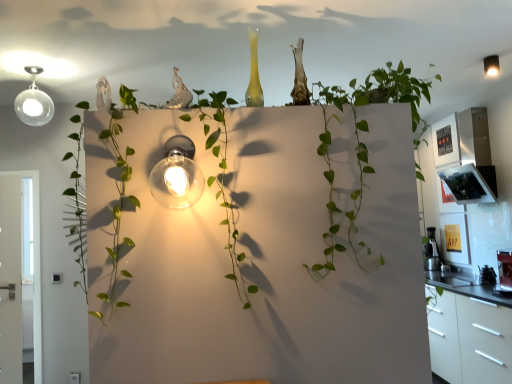
Question: Is matte black light fixture at upper right, which is counted as the second light fixture, starting from the left, thinner than metallic silver coffee maker at right?

Choices:
 (A) no
 (B) yes

Answer: (B)

Question: From a real-world perspective, is matte black light fixture at upper right, which is the 2th light fixture in front-to-back order, beneath metallic silver coffee maker at right?

Choices:
 (A) no
 (B) yes

Answer: (A)

Question: Can you confirm if matte black light fixture at upper right, which is counted as the second light fixture, starting from the left, is wider than metallic silver coffee maker at right?

Choices:
 (A) no
 (B) yes

Answer: (A)

Question: Is matte black light fixture at upper right, which is the 2th light fixture in front-to-back order, to the right of metallic silver coffee maker at right from the viewer's perspective?

Choices:
 (A) no
 (B) yes

Answer: (A)

Question: Considering the relative sizes of matte black light fixture at upper right, which is the 2th light fixture in front-to-back order, and metallic silver coffee maker at right in the image provided, is matte black light fixture at upper right, which is the 2th light fixture in front-to-back order, bigger than metallic silver coffee maker at right?

Choices:
 (A) no
 (B) yes

Answer: (A)

Question: Looking at their shapes, would you say white glossy cabinet at right is wider or thinner than clear glass light fixture at center, placed as the second light fixture when sorted from right to left?

Choices:
 (A) wide
 (B) thin

Answer: (A)

Question: From their relative heights in the image, would you say white glossy cabinet at right is taller or shorter than clear glass light fixture at center, the 1th light fixture from the bottom?

Choices:
 (A) tall
 (B) short

Answer: (A)

Question: Which is correct: white glossy cabinet at right is inside clear glass light fixture at center, which is the first light fixture in front-to-back order, or outside of it?

Choices:
 (A) outside
 (B) inside

Answer: (A)

Question: Is point (483, 319) positioned closer to the camera than point (186, 157)?

Choices:
 (A) farther
 (B) closer

Answer: (A)

Question: Is point (497, 59) positioned closer to the camera than point (449, 362)?

Choices:
 (A) closer
 (B) farther

Answer: (A)

Question: Visually, is matte black light fixture at upper right, marked as the 1th light fixture in a right-to-left arrangement, positioned to the left or to the right of white glossy cabinet at right?

Choices:
 (A) right
 (B) left

Answer: (B)

Question: From the image's perspective, is matte black light fixture at upper right, which is the 2th light fixture in front-to-back order, above or below white glossy cabinet at right?

Choices:
 (A) above
 (B) below

Answer: (A)

Question: From a real-world perspective, is matte black light fixture at upper right, placed as the first light fixture when sorted from top to bottom, physically located above or below white glossy cabinet at right?

Choices:
 (A) below
 (B) above

Answer: (B)

Question: From a real-world perspective, relative to metallic silver coffee maker at right, is matte black light fixture at upper right, which is the 2th light fixture in front-to-back order, vertically above or below?

Choices:
 (A) above
 (B) below

Answer: (A)

Question: Considering their positions, is matte black light fixture at upper right, marked as the 1th light fixture in a right-to-left arrangement, located in front of or behind metallic silver coffee maker at right?

Choices:
 (A) front
 (B) behind

Answer: (A)